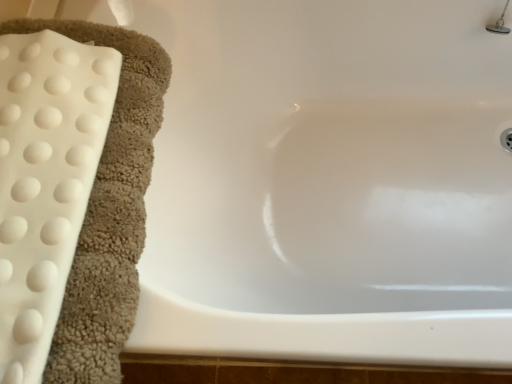
You are a GUI agent. You are given a task and a screenshot of the screen. Output one action in this format:
    pyautogui.click(x=<x>, y=<y>)
    Task: Click on the free point above beige fluffy bath towel at left (from a real-world perspective)
    This screenshot has height=384, width=512.
    Given the screenshot: What is the action you would take?
    pyautogui.click(x=41, y=145)